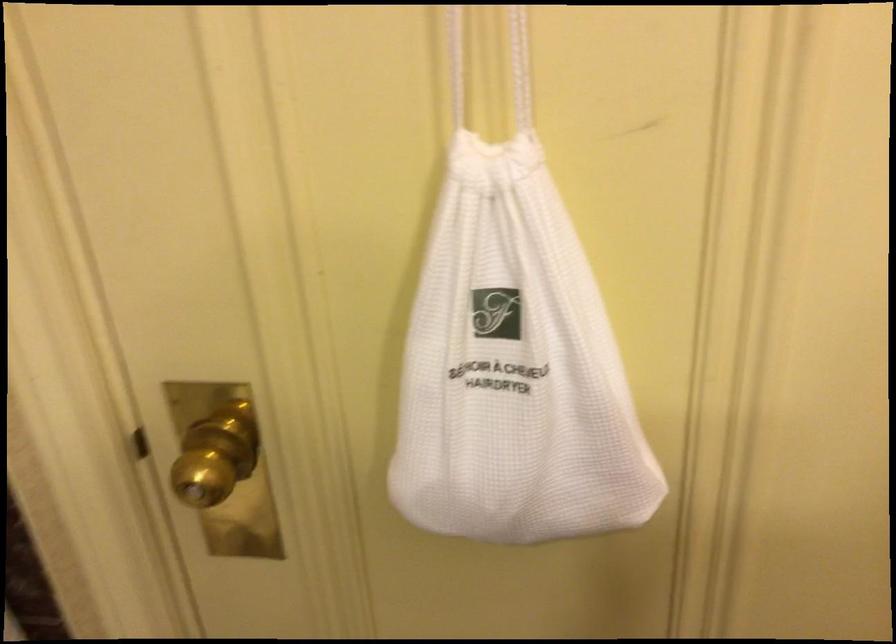
Find where to turn the gold door knob. Please return your answer as a coordinate pair (x, y).

(216, 456)